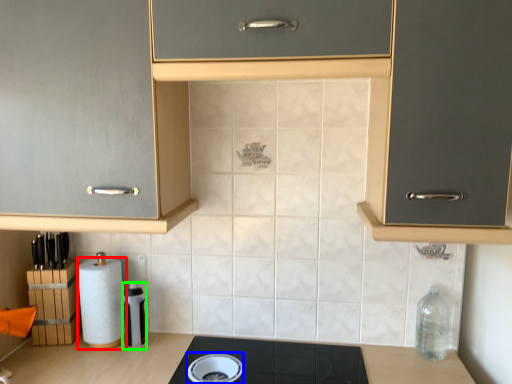
Question: Based on their relative distances, which object is nearer to paper towel (highlighted by a red box)? Choose from appliance (highlighted by a blue box) and appliance (highlighted by a green box).

Choices:
 (A) appliance
 (B) appliance

Answer: (B)